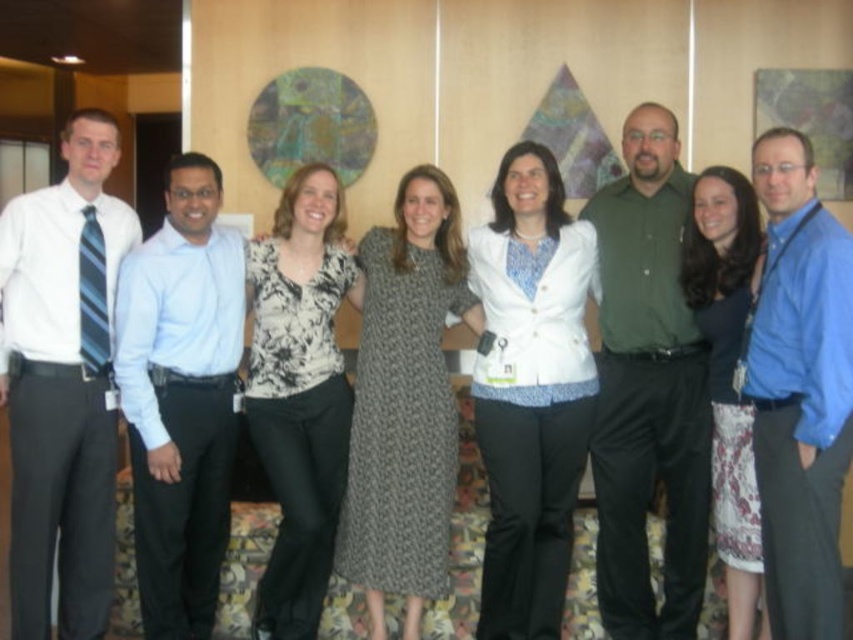
Question: Which is farther from the dark blue textured dress at center?

Choices:
 (A) knit fabric dress at center
 (B) green cotton shirt at center
 (C) matte white shirt at left
 (D) floral print blouse at center

Answer: (C)

Question: Which is farther from the white textured blazer at center?

Choices:
 (A) floral print blouse at center
 (B) light blue shirt at center
 (C) dark blue textured dress at center

Answer: (B)

Question: Can you confirm if floral print blouse at center is smaller than dark blue textured dress at center?

Choices:
 (A) no
 (B) yes

Answer: (A)

Question: Is knit fabric dress at center closer to camera compared to dark blue textured dress at center?

Choices:
 (A) yes
 (B) no

Answer: (B)

Question: Which of these objects is positioned closest to the matte white shirt at left?

Choices:
 (A) knit fabric dress at center
 (B) floral print blouse at center
 (C) blue shirt at center
 (D) white textured blazer at center

Answer: (B)

Question: Can you confirm if knit fabric dress at center is smaller than dark blue textured dress at center?

Choices:
 (A) no
 (B) yes

Answer: (A)